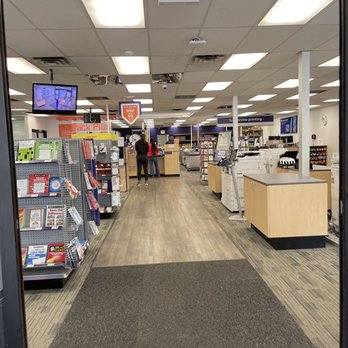
In order to click on off-white tiled ceiling in this screenshot , I will do `click(171, 36)`.